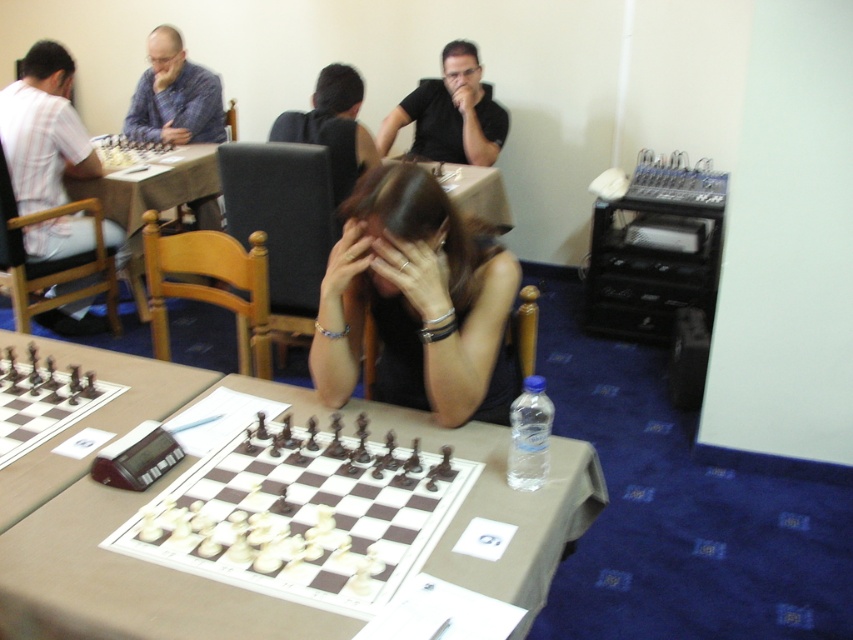
Question: Which point is farther to the camera?

Choices:
 (A) striped cotton shirt at left
 (B) black fabric hair at center

Answer: (A)

Question: Which of the following is the farthest from the observer?

Choices:
 (A) (422, 362)
 (B) (213, 573)

Answer: (A)

Question: Does striped cotton shirt at left have a lesser width compared to black hair at center?

Choices:
 (A) no
 (B) yes

Answer: (B)

Question: Where is white plastic chessboard at center located in relation to black hair at center in the image?

Choices:
 (A) above
 (B) below

Answer: (B)

Question: Observing the image, what is the correct spatial positioning of black fabric hair at center in reference to brown leather table at center?

Choices:
 (A) below
 (B) above

Answer: (A)

Question: Which object is farther from the camera taking this photo?

Choices:
 (A) black matte shirt at upper center
 (B) striped cotton shirt at left

Answer: (A)